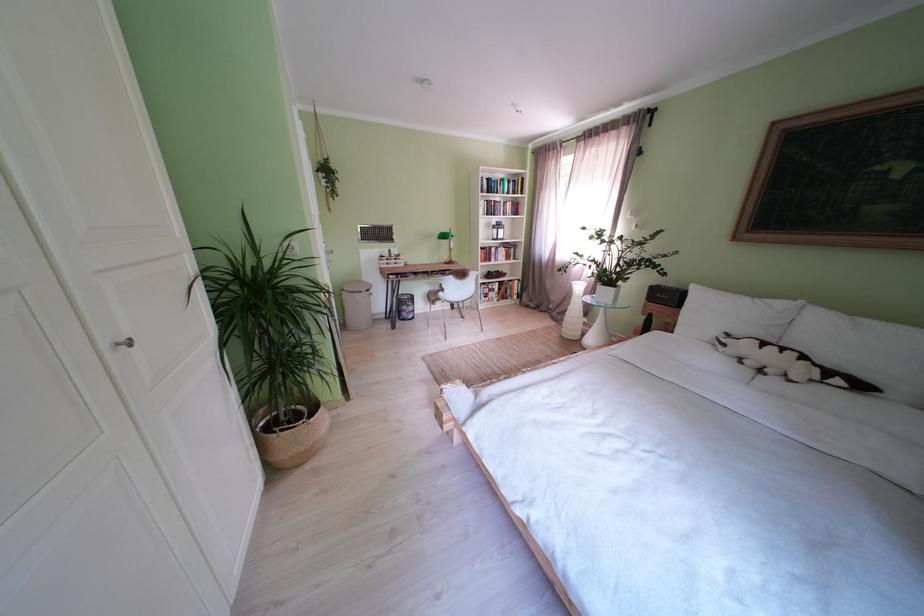
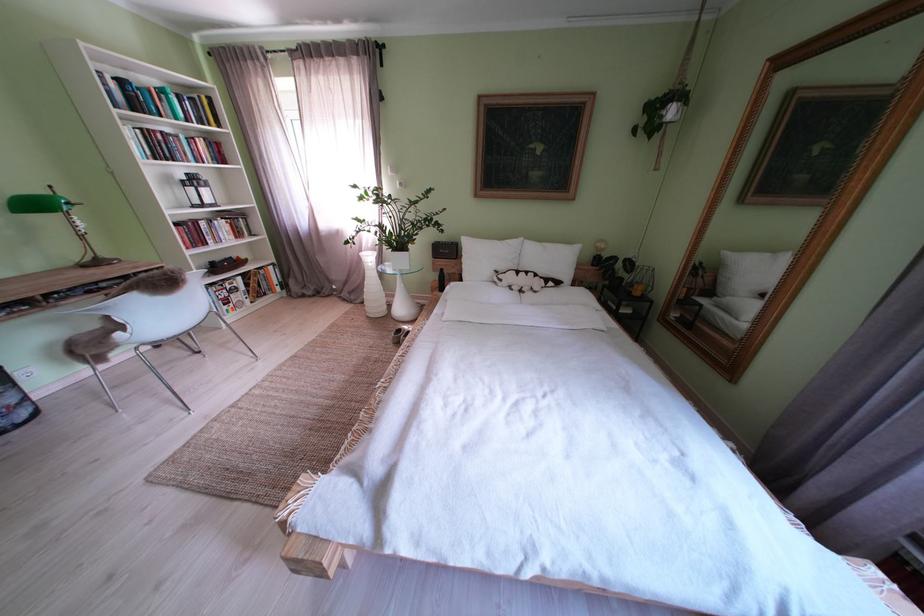
In the second image, find the point that corresponds to [569,323] in the first image.

(363, 302)